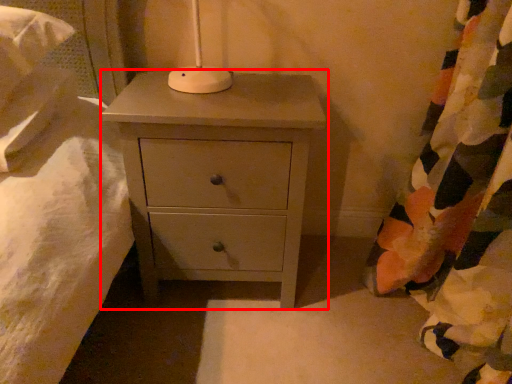
Question: Considering the relative positions of chest of drawers (annotated by the red box) and curtain in the image provided, where is chest of drawers (annotated by the red box) located with respect to the staircase?

Choices:
 (A) left
 (B) right

Answer: (A)